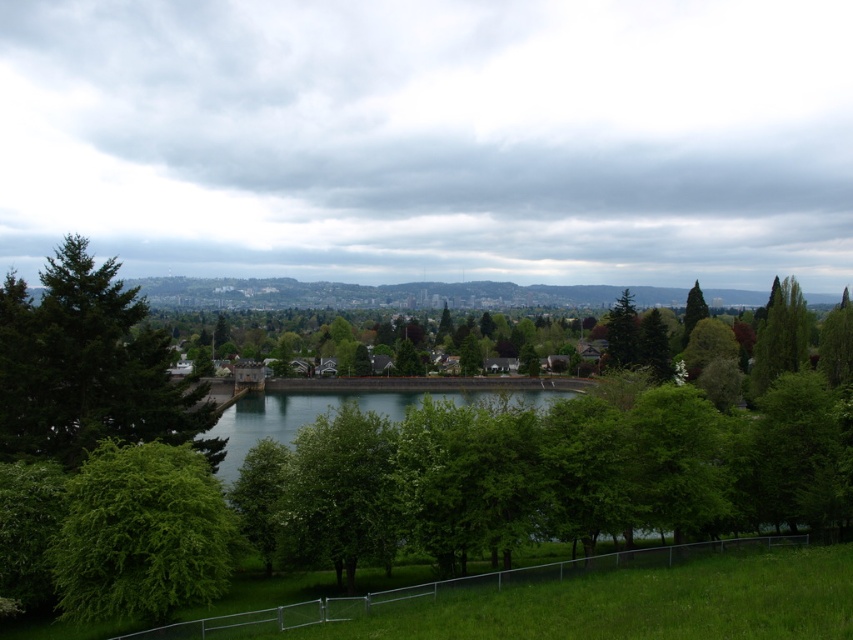
Is green leafy tree at lower left to the left of green leafy tree at center from the viewer's perspective?

Yes, green leafy tree at lower left is to the left of green leafy tree at center.

The height and width of the screenshot is (640, 853). Describe the element at coordinates (142, 534) in the screenshot. I see `green leafy tree at lower left` at that location.

Image resolution: width=853 pixels, height=640 pixels. I want to click on green leafy tree at lower left, so click(142, 534).

Between point (39, 336) and point (242, 433), which one is positioned behind?

Point (242, 433)

Can you confirm if green matte tree at left is shorter than greenish-blue water at center?

Yes, green matte tree at left is shorter than greenish-blue water at center.

Between point (15, 440) and point (502, 396), which one is positioned behind?

The point (502, 396) is behind.

The height and width of the screenshot is (640, 853). I want to click on green matte tree at left, so pos(88,365).

Which of these two, green matte tree at left or green leafy tree at lower left, stands shorter?

With less height is green leafy tree at lower left.

Is point (169, 342) closer to camera compared to point (154, 493)?

No, (169, 342) is further to viewer.

Locate an element on the screen. The height and width of the screenshot is (640, 853). green matte tree at left is located at coordinates (88, 365).